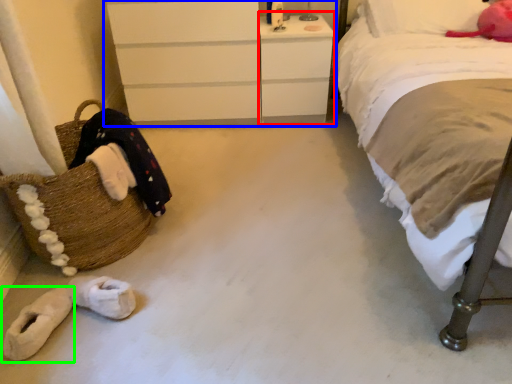
Question: Which is nearer to the vanity (highlighted by a red box)? chest of drawers (highlighted by a blue box) or footwear (highlighted by a green box).

Choices:
 (A) chest of drawers
 (B) footwear

Answer: (A)